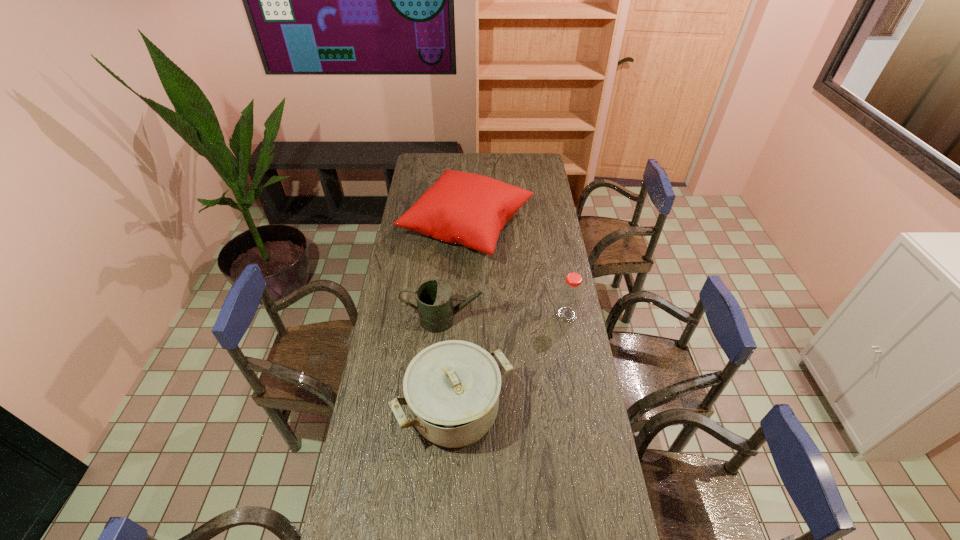
The width and height of the screenshot is (960, 540). Find the location of `watering can that is at the left edge`. watering can that is at the left edge is located at coordinates (434, 297).

Find the location of a particular element. This screenshot has width=960, height=540. cushion that is at the right edge is located at coordinates (469, 209).

Locate an element on the screen. Image resolution: width=960 pixels, height=540 pixels. bottle situated at the right edge is located at coordinates (570, 296).

The height and width of the screenshot is (540, 960). In the image, there is a desktop. In order to click on vacant space at the far edge in this screenshot , I will do `click(518, 162)`.

You are a GUI agent. You are given a task and a screenshot of the screen. Output one action in this format:
    pyautogui.click(x=<x>, y=<y>)
    Task: Click on the vacant space at the left edge of the desktop
    This screenshot has height=540, width=960.
    Given the screenshot: What is the action you would take?
    pyautogui.click(x=399, y=503)

Find the location of a particular element. vacant point at the right edge is located at coordinates (566, 454).

What are the coordinates of `vacant space at the far right corner of the desktop` in the screenshot? It's located at (531, 171).

Image resolution: width=960 pixels, height=540 pixels. Identify the location of vacant point located between the bottle and the farthest object. (516, 271).

Locate an element on the screen. This screenshot has height=540, width=960. empty space that is in between the rightmost object and the nearest object is located at coordinates (511, 363).

The width and height of the screenshot is (960, 540). I want to click on free space between the nearest object and the bottle, so click(511, 363).